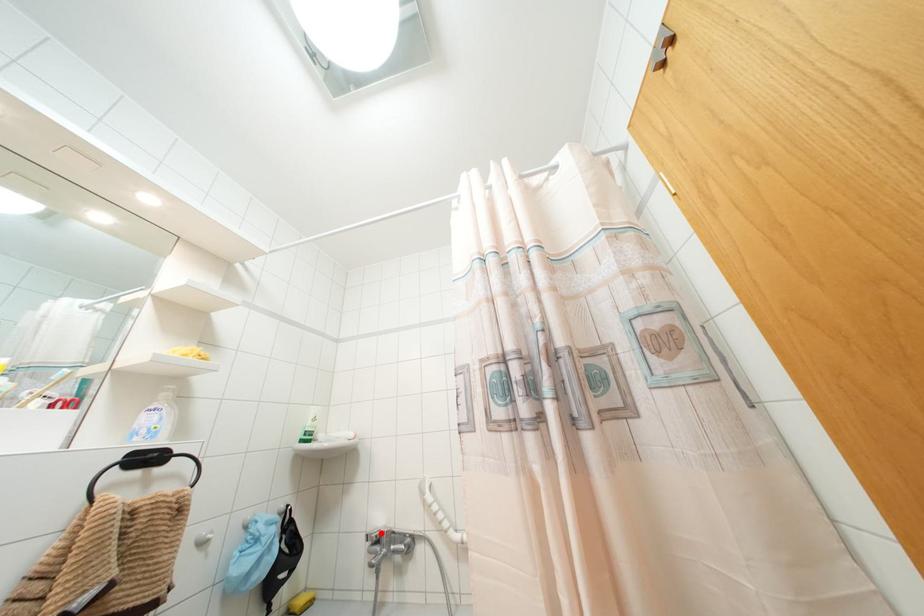
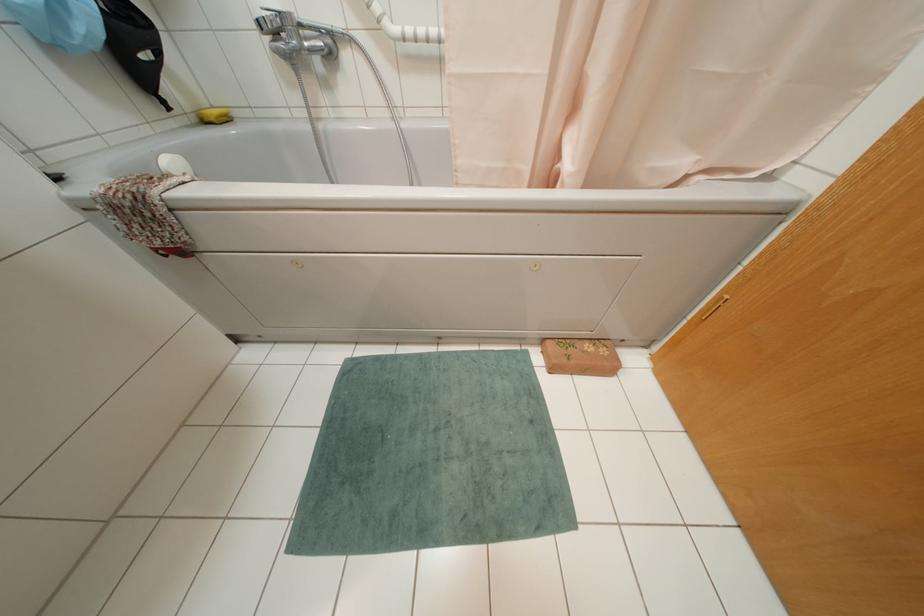
The point at the highlighted location is marked in the first image. Where is the corresponding point in the second image?

(278, 12)